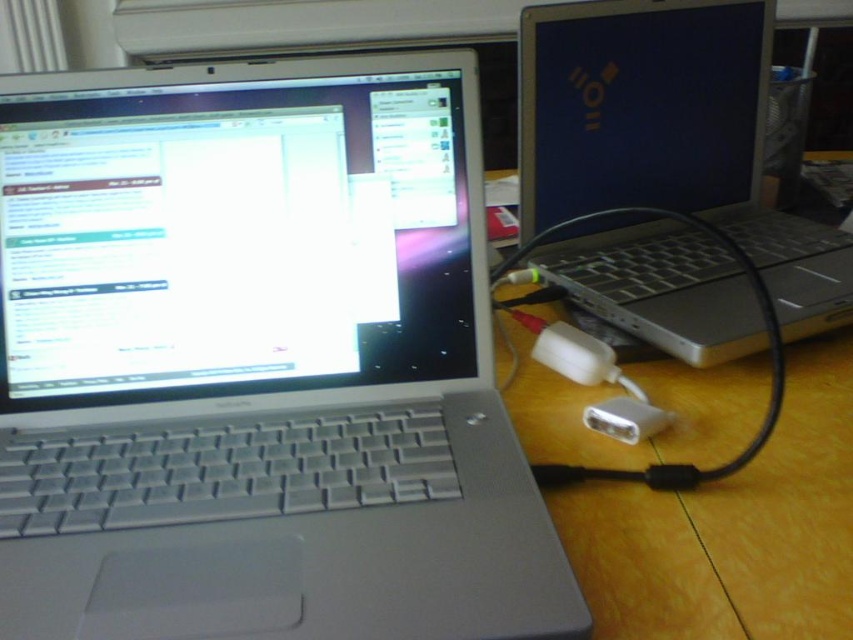
You are a photographer taking a picture of the two laptops. You notice two points marked in the scene. Which point, point (x=364, y=84) or point (x=561, y=218), is closer to you?

Point (x=364, y=84) is closer to the viewer than point (x=561, y=218).

You are a delivery robot with a package that measures 12 inches in length. You need to place it between the silver metallic laptop at left and the silver metallic laptop at right on the desk. Can you fit the package between them without moving the laptops?

The distance between the silver metallic laptop at left and the silver metallic laptop at right is 10.90 inches. Since the package is 12 inches long, which is longer than the available space, it cannot fit between them without moving the laptops.

You are organizing a tech event and need to place two laptops on a table. The silver metallic laptop at left and the silver metallic laptop at right must be arranged so that the smaller one is on the left side of the larger one. Is the current arrangement correct?

The silver metallic laptop at left is smaller than the silver metallic laptop at right, so the current arrangement already has the smaller laptop on the left side of the larger one, which meets the requirement.